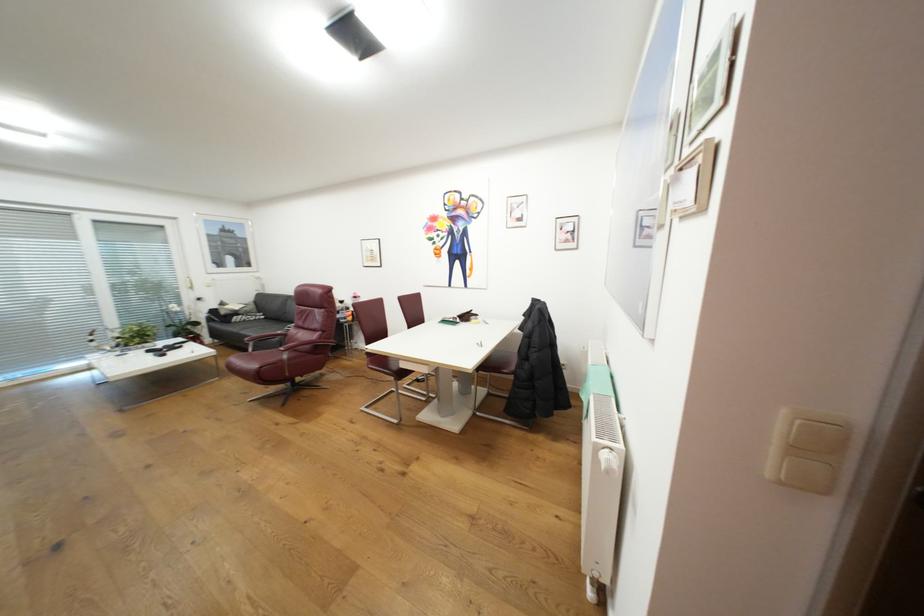
Where would you sit the black sofa sitting surface? Please return your answer as a coordinate pair (x, y).

(249, 317)